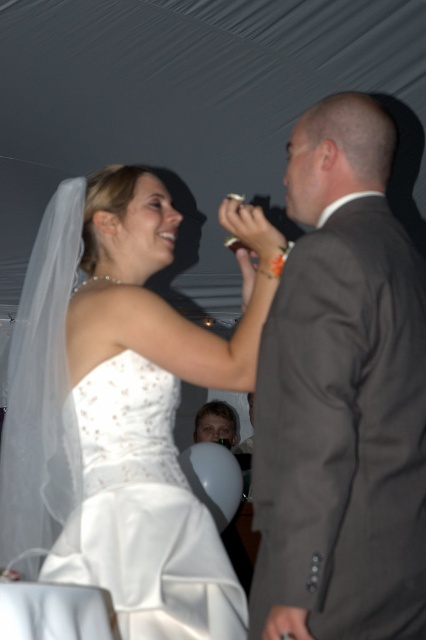
Question: Can you confirm if white satin dress at upper left is wider than matte gray suit at right?

Choices:
 (A) yes
 (B) no

Answer: (A)

Question: Is matte gray suit at right bigger than white satin wedding dress at center?

Choices:
 (A) no
 (B) yes

Answer: (B)

Question: Which object is positioned farthest from the white satin dress at upper left?

Choices:
 (A) matte gray suit at right
 (B) white satin wedding dress at center

Answer: (A)

Question: Where is white satin dress at upper left located in relation to matte gray suit at right in the image?

Choices:
 (A) above
 (B) below

Answer: (B)

Question: Which object is positioned farthest from the matte gray suit at right?

Choices:
 (A) white satin dress at upper left
 (B) white satin wedding dress at center

Answer: (A)

Question: Which object is positioned farthest from the white satin dress at upper left?

Choices:
 (A) matte gray suit at right
 (B) white satin wedding dress at center

Answer: (A)